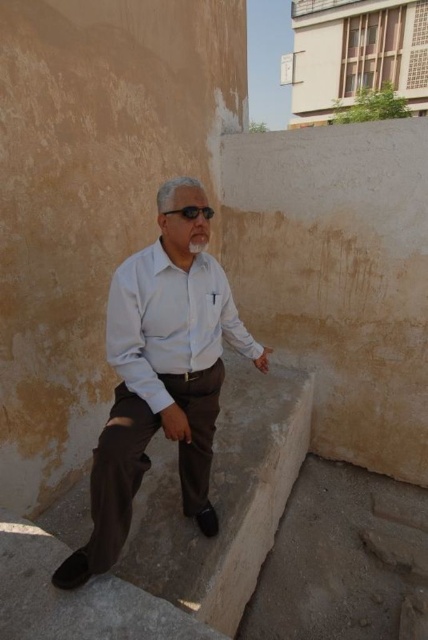
Between point (115, 339) and point (199, 211), which one is positioned behind?

The point (115, 339) is behind.

Looking at this image, which is more to the left, light blue cotton shirt at center or black matte sunglasses at center?

Positioned to the left is black matte sunglasses at center.

At what (x,y) coordinates should I click in order to perform the action: click on light blue cotton shirt at center. Please return your answer as a coordinate pair (x, y). The height and width of the screenshot is (640, 428). Looking at the image, I should click on (169, 321).

This screenshot has width=428, height=640. What are the coordinates of `light blue cotton shirt at center` in the screenshot? It's located at (169, 321).

Can you confirm if light blue shirt at center is bigger than black matte sunglasses at center?

Yes.

Can you confirm if light blue shirt at center is positioned above black matte sunglasses at center?

Incorrect, light blue shirt at center is not positioned above black matte sunglasses at center.

The image size is (428, 640). Describe the element at coordinates (160, 376) in the screenshot. I see `light blue shirt at center` at that location.

This screenshot has height=640, width=428. I want to click on light blue shirt at center, so click(x=160, y=376).

Can you confirm if light blue shirt at center is wider than light blue cotton shirt at center?

Yes, light blue shirt at center is wider than light blue cotton shirt at center.

Is light blue shirt at center thinner than light blue cotton shirt at center?

Incorrect, light blue shirt at center's width is not less than light blue cotton shirt at center's.

Between point (112, 556) and point (130, 310), which one is positioned behind?

Point (130, 310)

Locate an element on the screen. Image resolution: width=428 pixels, height=640 pixels. light blue shirt at center is located at coordinates (160, 376).